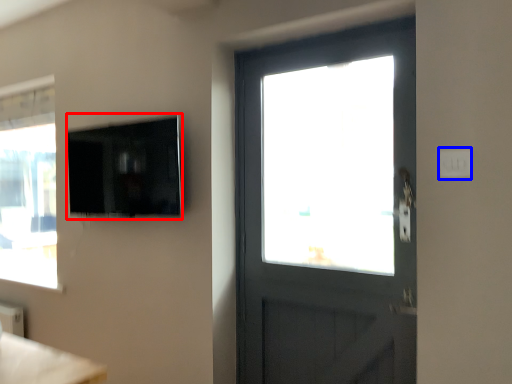
Question: Which point is further to the camera, window screen (highlighted by a red box) or light switch (highlighted by a blue box)?

Choices:
 (A) window screen
 (B) light switch

Answer: (A)